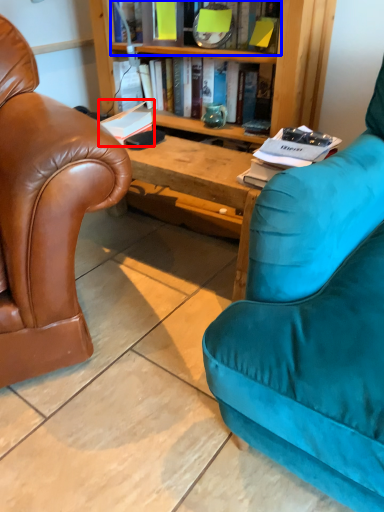
Question: Among these objects, which one is farthest to the camera, book (highlighted by a red box) or book (highlighted by a blue box)?

Choices:
 (A) book
 (B) book

Answer: (A)